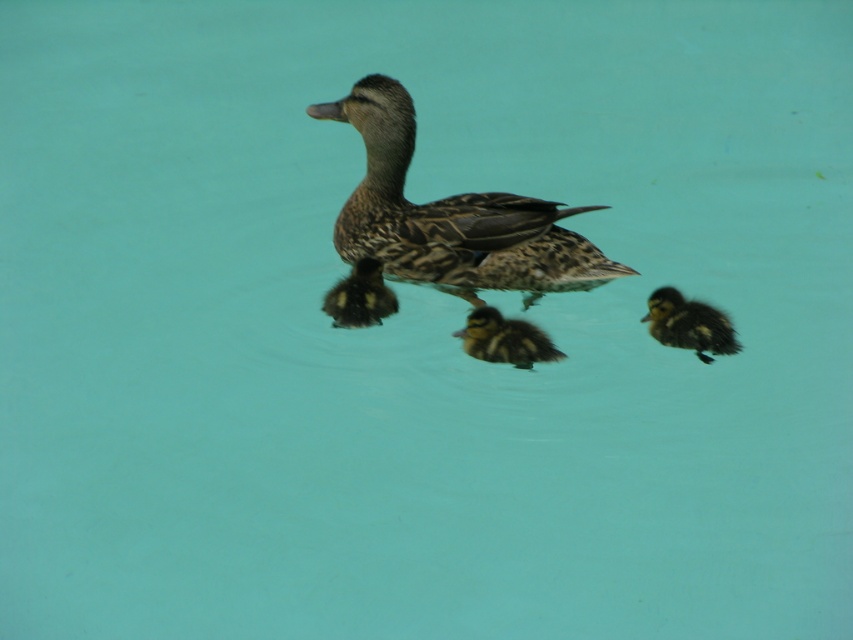
Question: Which point is closer to the camera taking this photo?

Choices:
 (A) (718, 346)
 (B) (392, 120)

Answer: (A)

Question: Which of the following is the farthest from the observer?

Choices:
 (A) soft brown downy duckling at center
 (B) brown fluffy duckling at center
 (C) brown speckled duckling at center
 (D) fluffy brown duckling at right

Answer: (C)

Question: In this image, where is brown speckled duckling at center located relative to fluffy brown duckling at right?

Choices:
 (A) left
 (B) right

Answer: (A)

Question: Is fluffy brown duckling at right wider than soft brown downy duckling at center?

Choices:
 (A) yes
 (B) no

Answer: (A)

Question: Which of these objects is positioned closest to the fluffy brown duckling at right?

Choices:
 (A) brown fluffy duckling at center
 (B) brown speckled duckling at center

Answer: (A)

Question: From the image, what is the correct spatial relationship of brown speckled duckling at center in relation to soft brown downy duckling at center?

Choices:
 (A) right
 (B) left

Answer: (A)